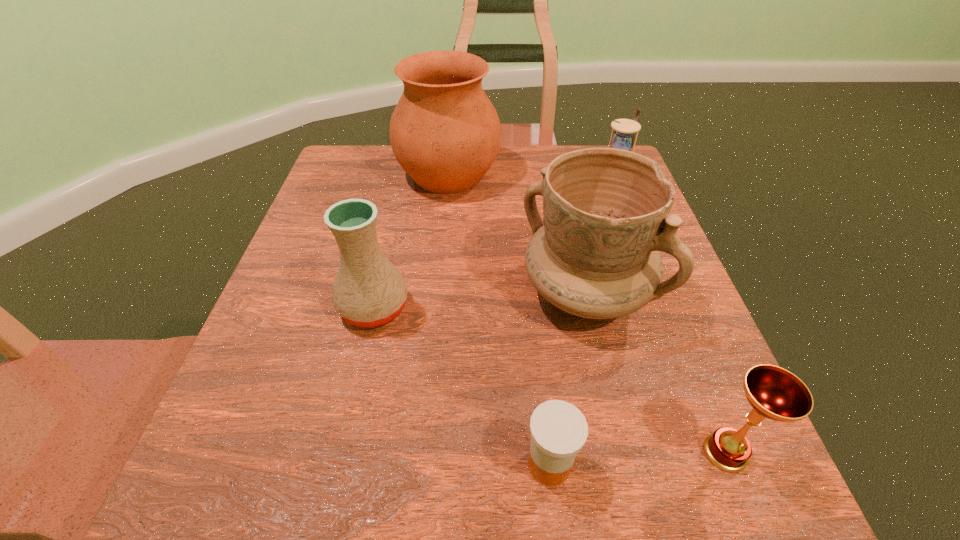
This screenshot has width=960, height=540. I want to click on pottery that is the second nearest to the chalice, so click(369, 291).

Where is `vacant area that satisfies the following two spatial constraints: 1. on the front side of the chalice; 2. on the label of the medicine`? vacant area that satisfies the following two spatial constraints: 1. on the front side of the chalice; 2. on the label of the medicine is located at coordinates (730, 464).

At what (x,y) coordinates should I click in order to perform the action: click on free space that satisfies the following two spatial constraints: 1. on the front side of the farthest pottery; 2. on the left side of the rightmost pottery. Please return your answer as a coordinate pair (x, y). This screenshot has width=960, height=540. Looking at the image, I should click on (437, 293).

Image resolution: width=960 pixels, height=540 pixels. I want to click on free space that satisfies the following two spatial constraints: 1. on the front side of the hourglass; 2. on the right side of the chalice, so click(x=714, y=453).